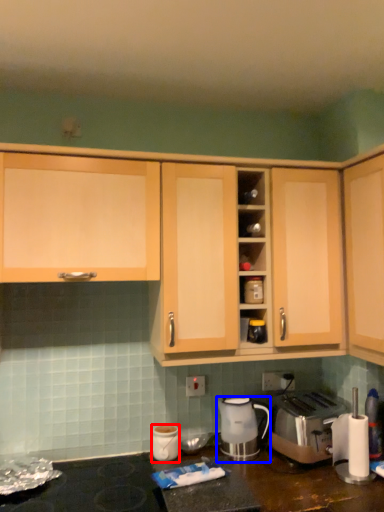
Question: Among these objects, which one is nearest to the camera, kitchen appliance (highlighted by a red box) or home appliance (highlighted by a blue box)?

Choices:
 (A) kitchen appliance
 (B) home appliance

Answer: (A)